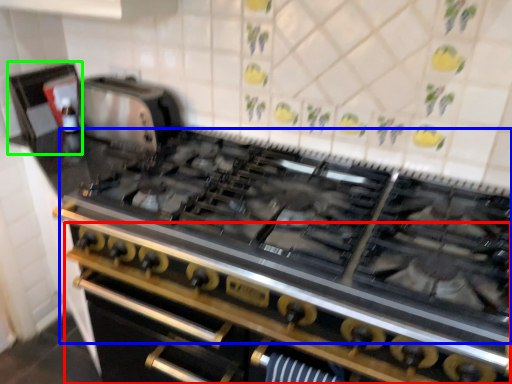
Question: Which object is positioned closest to oven (highlighted by a red box)? Select from gas stove (highlighted by a blue box) and appliance (highlighted by a green box).

Choices:
 (A) gas stove
 (B) appliance

Answer: (A)